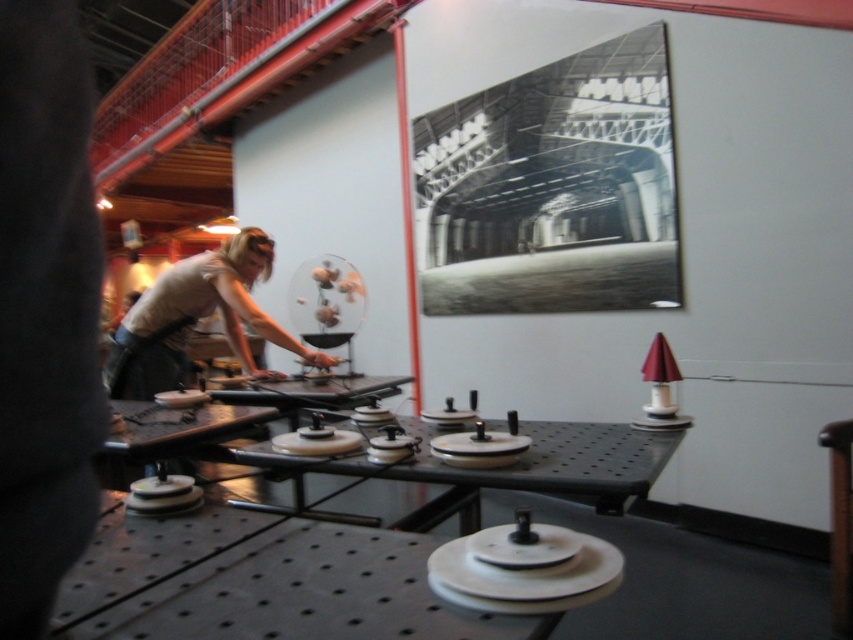
You are an attendee at an exhibition and you see the metallic industrial structure at upper center and the light beige fabric shirt at left. Which object is closer to you?

The metallic industrial structure at upper center is closer to you because the light beige fabric shirt at left is behind it.

You are standing in the workshop and need to locate the metallic industrial structure at upper center. According to the coordinates provided, where exactly is it positioned?

The metallic industrial structure at upper center is located at point coordinates of 0.209 on the x axis and 0.649 on the y axis.

You are standing in the workshop and need to locate the point at coordinates (553,132). According to the image, where would this point be located?

The point at coordinates (553,132) is on the metallic industrial structure at upper center.